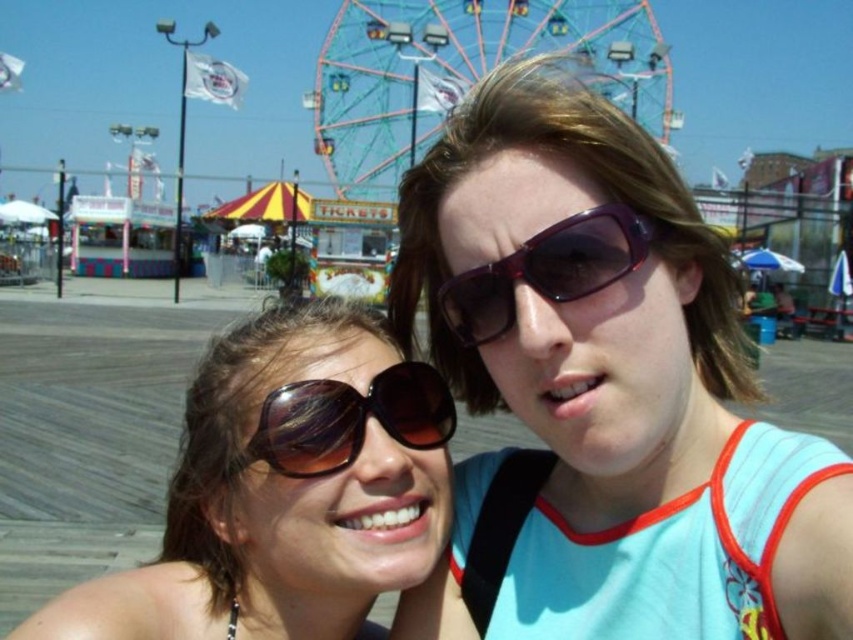
Between point (24, 636) and point (395, 394), which one is positioned in front?

Point (24, 636)

Locate an element on the screen. The width and height of the screenshot is (853, 640). brown matte sunglasses at center is located at coordinates (286, 490).

Is metallic blue ferris wheel at upper center thinner than matte brown sunglasses at center?

No.

Consider the image. Between metallic blue ferris wheel at upper center and matte brown sunglasses at center, which one has more height?

metallic blue ferris wheel at upper center

Is point (350, 160) positioned in front of point (511, 275)?

No.

Locate an element on the screen. This screenshot has width=853, height=640. metallic blue ferris wheel at upper center is located at coordinates (462, 72).

Which is in front, point (199, 577) or point (643, 72)?

Positioned in front is point (199, 577).

Between brown matte sunglasses at center and metallic blue ferris wheel at upper center, which one appears on the left side from the viewer's perspective?

From the viewer's perspective, brown matte sunglasses at center appears more on the left side.

Is point (132, 628) positioned after point (320, 74)?

No, (132, 628) is closer to viewer.

Locate an element on the screen. brown matte sunglasses at center is located at coordinates (286, 490).